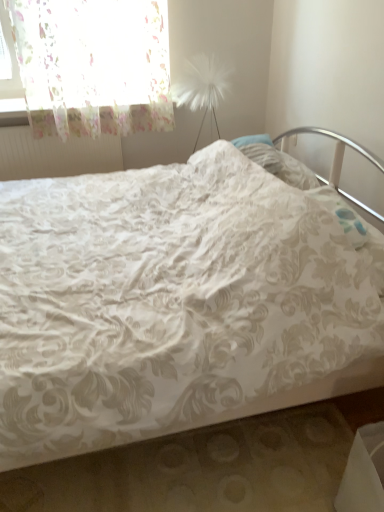
This screenshot has width=384, height=512. Identify the location of translucent floral fabric at upper left. (93, 65).

What is the approximate height of white textured radiator at upper left?

14.11 inches.

Locate an element on the screen. The height and width of the screenshot is (512, 384). white floral fabric bed at center is located at coordinates (173, 304).

Which object is more forward, white textured radiator at upper left or white floral fabric bed at center?

white floral fabric bed at center is in front.

In the scene shown: Does white textured radiator at upper left turn towards white floral fabric bed at center?

Yes, white textured radiator at upper left is turned towards white floral fabric bed at center.

How many degrees apart are the facing directions of white floral fabric bed at center and white textured radiator at upper left?

The facing directions of white floral fabric bed at center and white textured radiator at upper left are 91.1 degrees apart.

Consider the image. Does white floral fabric bed at center appear on the left side of white textured radiator at upper left?

Incorrect, white floral fabric bed at center is not on the left side of white textured radiator at upper left.

Can you see white floral fabric bed at center touching white textured radiator at upper left?

There is a gap between white floral fabric bed at center and white textured radiator at upper left.

Considering the sizes of white floral fabric bed at center and white textured radiator at upper left in the image, is white floral fabric bed at center taller or shorter than white textured radiator at upper left?

Clearly, white floral fabric bed at center is taller compared to white textured radiator at upper left.

Can you confirm if white textured radiator at upper left is smaller than translucent floral fabric at upper left?

Indeed, white textured radiator at upper left has a smaller size compared to translucent floral fabric at upper left.

Is white textured radiator at upper left wider or thinner than translucent floral fabric at upper left?

Considering their sizes, white textured radiator at upper left looks slimmer than translucent floral fabric at upper left.

From a real-world perspective, is white textured radiator at upper left located higher than translucent floral fabric at upper left?

Incorrect, from a real-world perspective, white textured radiator at upper left is lower than translucent floral fabric at upper left.

From the image's perspective, would you say white floral fabric bed at center is positioned over translucent floral fabric at upper left?

Actually, white floral fabric bed at center appears below translucent floral fabric at upper left in the image.

Is white floral fabric bed at center shorter than translucent floral fabric at upper left?

No.

From a real-world perspective, is white floral fabric bed at center above or below translucent floral fabric at upper left?

In terms of real-world spatial position, white floral fabric bed at center is below translucent floral fabric at upper left.

Considering the positions of point (149, 11) and point (84, 437), is point (149, 11) closer or farther from the camera than point (84, 437)?

Point (149, 11) is farther from the camera than point (84, 437).

How many degrees apart are the facing directions of translucent floral fabric at upper left and white floral fabric bed at center?

90.8 degrees separate the facing orientations of translucent floral fabric at upper left and white floral fabric bed at center.

Considering the sizes of translucent floral fabric at upper left and white floral fabric bed at center in the image, is translucent floral fabric at upper left bigger or smaller than white floral fabric bed at center?

Considering their sizes, translucent floral fabric at upper left takes up less space than white floral fabric bed at center.

Considering the positions of objects translucent floral fabric at upper left and white floral fabric bed at center in the image provided, who is behind, translucent floral fabric at upper left or white floral fabric bed at center?

translucent floral fabric at upper left.

Find the location of `curtain above the white textured radiator at upper left (from a real-world perspective)`. curtain above the white textured radiator at upper left (from a real-world perspective) is located at coordinates (93, 65).

Does point (91, 124) come in front of point (3, 180)?

That is False.

Considering the sizes of translucent floral fabric at upper left and white textured radiator at upper left in the image, is translucent floral fabric at upper left wider or thinner than white textured radiator at upper left?

In the image, translucent floral fabric at upper left appears to be wider than white textured radiator at upper left.

Is translucent floral fabric at upper left beside white textured radiator at upper left?

No, translucent floral fabric at upper left is not making contact with white textured radiator at upper left.

You are a GUI agent. You are given a task and a screenshot of the screen. Output one action in this format:
    pyautogui.click(x=<x>, y=<y>)
    Task: Click on the radiator above the white floral fabric bed at center (from a real-world perspective)
    This screenshot has height=512, width=384.
    Given the screenshot: What is the action you would take?
    pyautogui.click(x=55, y=155)

Find the location of a particular element. This screenshot has height=512, width=384. bed located below the white textured radiator at upper left (from the image's perspective) is located at coordinates (173, 304).

Considering their positions, is white textured radiator at upper left positioned closer to white floral fabric bed at center than translucent floral fabric at upper left?

Among the two, translucent floral fabric at upper left is located nearer to white floral fabric bed at center.

When comparing their distances from translucent floral fabric at upper left, does white floral fabric bed at center or white textured radiator at upper left seem closer?

white textured radiator at upper left is positioned closer to the anchor translucent floral fabric at upper left.

Based on their spatial positions, is white textured radiator at upper left or white floral fabric bed at center closer to translucent floral fabric at upper left?

Among the two, white textured radiator at upper left is located nearer to translucent floral fabric at upper left.

Considering their positions, is white floral fabric bed at center positioned closer to white textured radiator at upper left than translucent floral fabric at upper left?

translucent floral fabric at upper left.

Considering their positions, is translucent floral fabric at upper left positioned closer to white floral fabric bed at center than white textured radiator at upper left?

Among the two, translucent floral fabric at upper left is located nearer to white floral fabric bed at center.

From the image, which object appears to be nearer to white textured radiator at upper left, translucent floral fabric at upper left or white floral fabric bed at center?

translucent floral fabric at upper left is closer to white textured radiator at upper left.

Locate an element on the screen. The image size is (384, 512). curtain located between white floral fabric bed at center and white textured radiator at upper left in the depth direction is located at coordinates (93, 65).